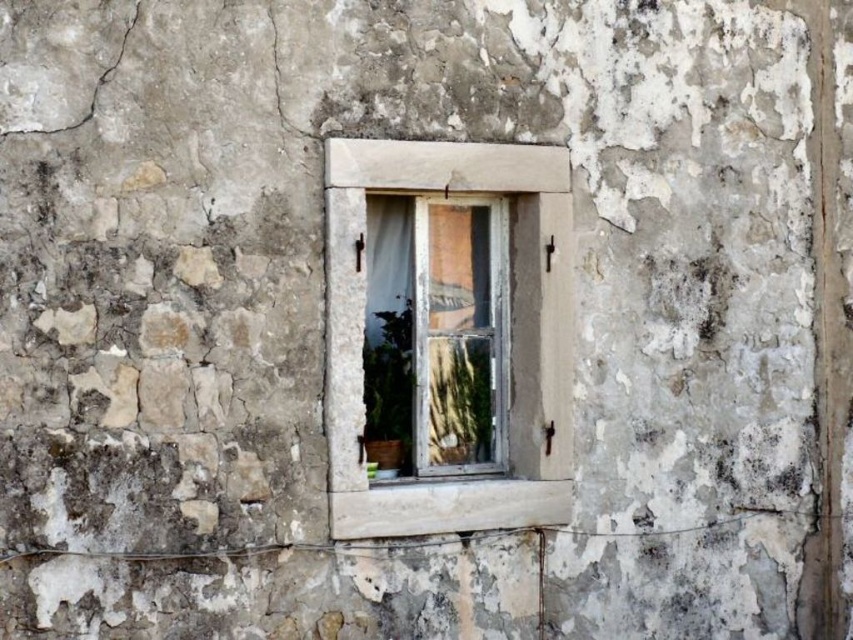
Based on the photo, you are an architect examining the stone wall and its window. From your vantage point, which object is nearer to you between the white stone window frame at center and the white wooden window at center?

The white stone window frame at center is closer to the viewer than the white wooden window at center.

You are an architect designing a new building and want to ensure that the window fits within the designated space. The space allocated for the window is exactly the same width as the white wooden window at center. Can the white stone window frame at center be placed in this space without adjustments?

The white stone window frame at center is wider than the white wooden window at center. Since the allocated space matches the wooden window width, the stone frame would not fit without adjustments.